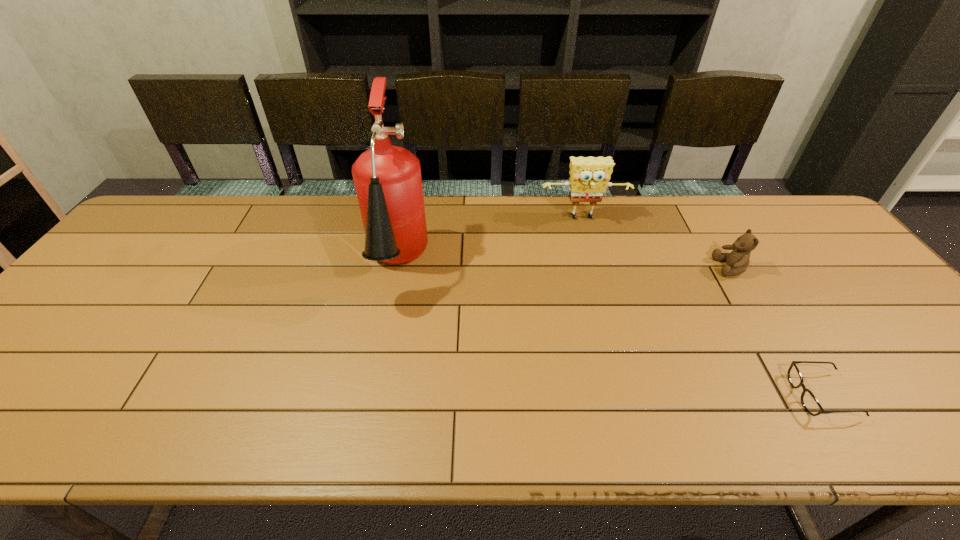
At what (x,y) coordinates should I click in order to perform the action: click on vacant space located on the front-facing side of the teddy bear. Please return your answer as a coordinate pair (x, y). Looking at the image, I should click on (644, 267).

At what (x,y) coordinates should I click in order to perform the action: click on vacant space situated on the front-facing side of the teddy bear. Please return your answer as a coordinate pair (x, y). Image resolution: width=960 pixels, height=540 pixels. Looking at the image, I should click on (690, 267).

Where is `blank space located on the front-facing side of the shortest object`? The width and height of the screenshot is (960, 540). blank space located on the front-facing side of the shortest object is located at coordinates (679, 395).

In order to click on blank space located 0.200m on the front-facing side of the shortest object in this screenshot , I will do `click(702, 395)`.

The height and width of the screenshot is (540, 960). Find the location of `vacant space situated 0.330m on the front-facing side of the shortest object`. vacant space situated 0.330m on the front-facing side of the shortest object is located at coordinates pyautogui.click(x=641, y=395).

Where is `fire extinguisher that is at the far edge`? This screenshot has width=960, height=540. fire extinguisher that is at the far edge is located at coordinates (387, 179).

The height and width of the screenshot is (540, 960). What are the coordinates of `sponge that is at the far edge` in the screenshot? It's located at (589, 176).

The width and height of the screenshot is (960, 540). I want to click on object that is positioned at the near edge, so click(809, 401).

You are a GUI agent. You are given a task and a screenshot of the screen. Output one action in this format:
    pyautogui.click(x=<x>, y=<y>)
    Task: Click on the vacant space at the far edge of the desktop
    The height and width of the screenshot is (540, 960).
    Given the screenshot: What is the action you would take?
    pyautogui.click(x=438, y=197)

This screenshot has width=960, height=540. I want to click on free space at the near edge of the desktop, so click(75, 431).